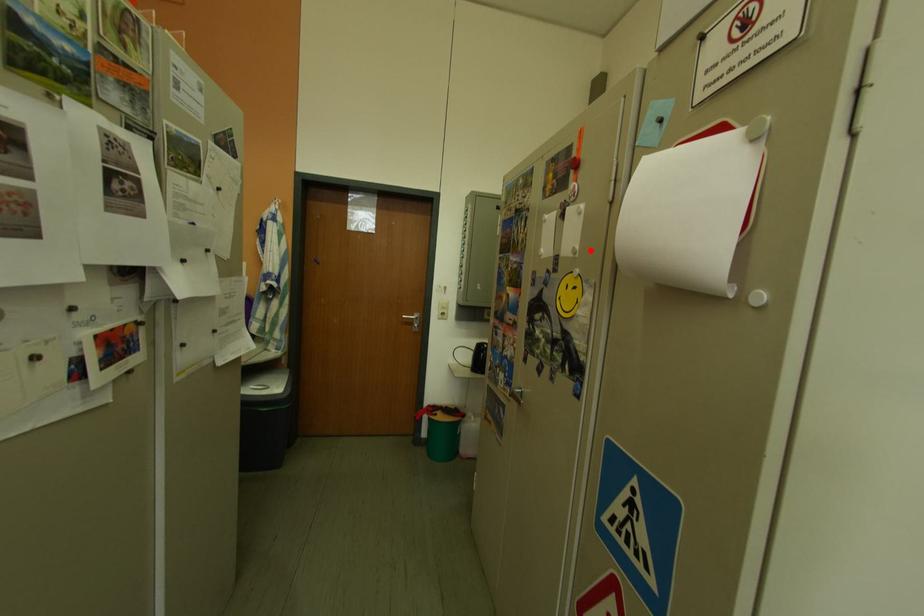
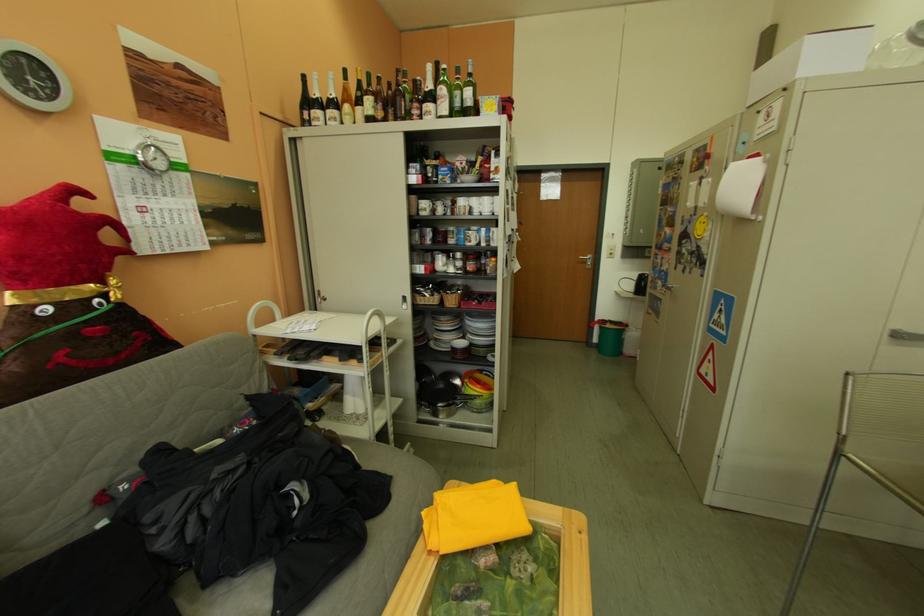
Where in the second image is the point corresponding to the highlighted location from the first image?

(720, 204)